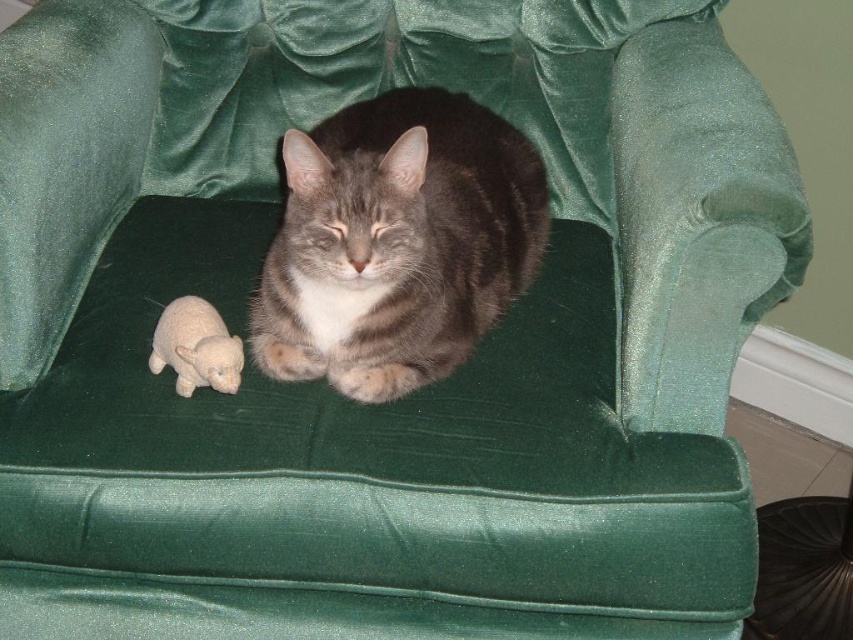
You are a photographer standing at a certain distance from the gray striped fur cat at center. You want to take a closeup photo of the cat without getting too close. Your camera has a zoom range of 50mm to 200mm. What is the minimum focal length you need to use to capture the cat clearly from your current position?

The gray striped fur cat at center and camera are 1.27 meters apart. To capture the cat clearly from 1.27 meters away with a zoom lens, the minimum focal length required would be 200mm, as this is the longest available zoom on your camera and necessary to achieve a closeup from that distance.

In the scene shown: Based on the scene description, can you determine if the gray striped fur cat at center is wider than the white plush bear at lower left?

The gray striped fur cat at center might be wider than white plush bear at lower left according to the description.

From the picture: You are standing 2 meters away from the chair where the cat is resting. There is a point at coordinates point (x=532, y=205). Can you reach that point with a 1.8 meter long stick without moving closer than your current position?

The distance of point (x=532, y=205) is 1.59 meters from the viewer. Since you are 2 meters away, the point is 0.41 meters closer. A 1.8 meter stick can extend beyond your current position, so yes, you can reach the point with the stick.